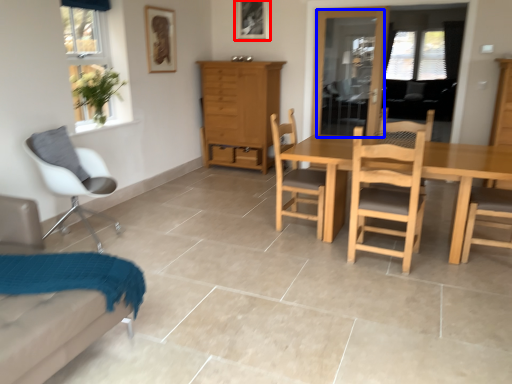
Question: Which object appears closest to the camera in this image, picture frame (highlighted by a red box) or glass door (highlighted by a blue box)?

Choices:
 (A) picture frame
 (B) glass door

Answer: (B)